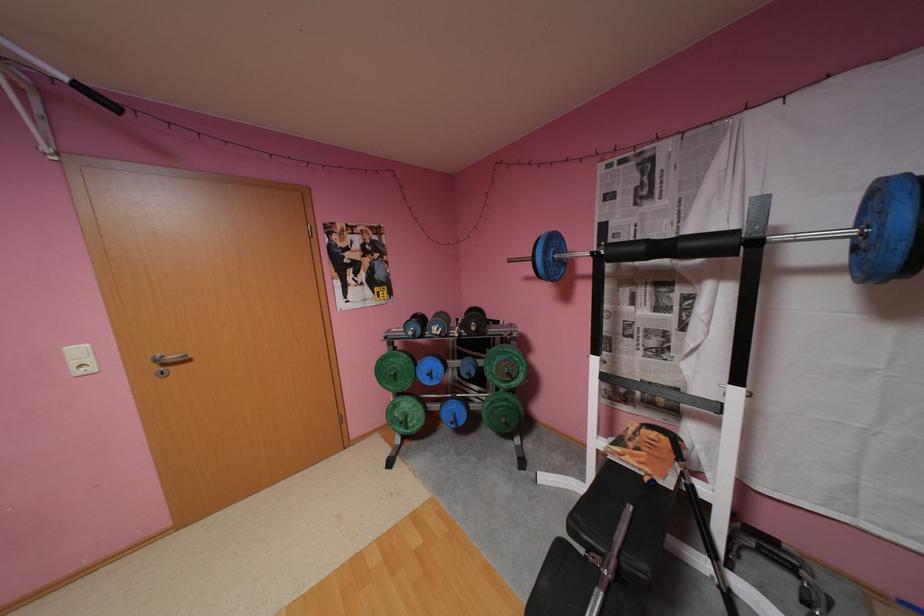
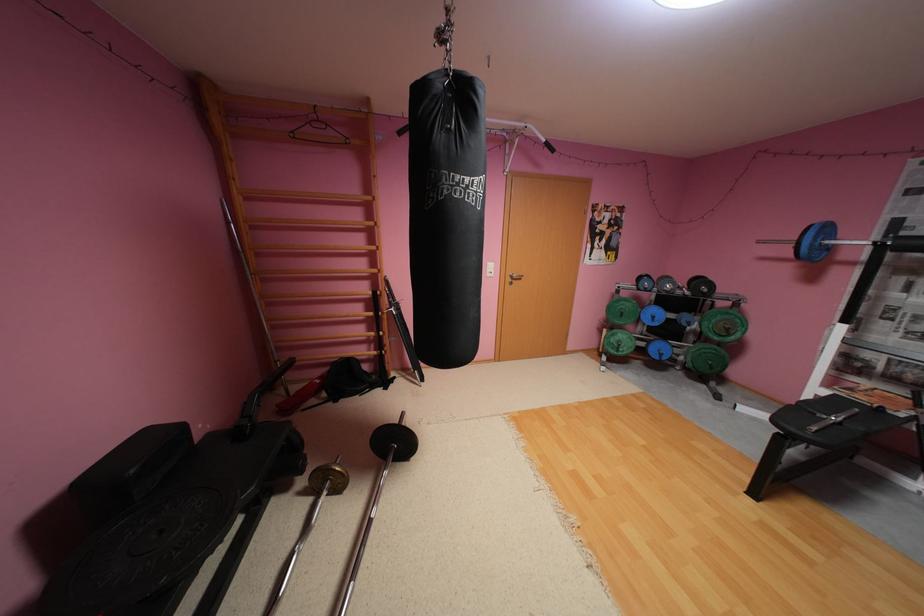
Find the pixel in the second image that matches point 416,427 in the first image.

(626, 351)